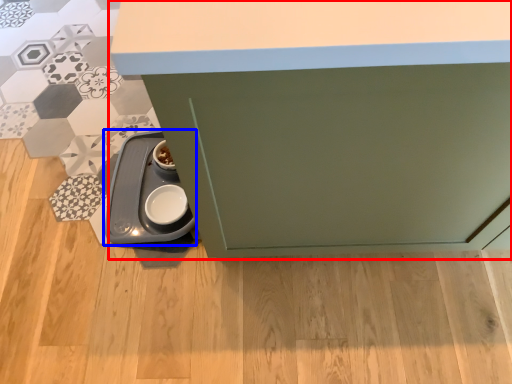
Question: Which of the following is the closest to the observer, cabinetry (highlighted by a red box) or appliance (highlighted by a blue box)?

Choices:
 (A) cabinetry
 (B) appliance

Answer: (A)